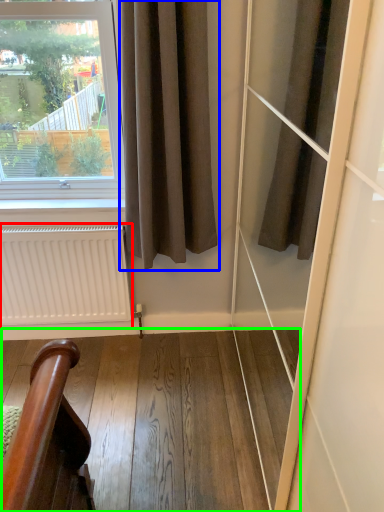
Question: Estimate the real-world distances between objects in this image. Which object is farther from radiator (highlighted by a red box), curtain (highlighted by a blue box) or stairwell (highlighted by a green box)?

Choices:
 (A) curtain
 (B) stairwell

Answer: (A)